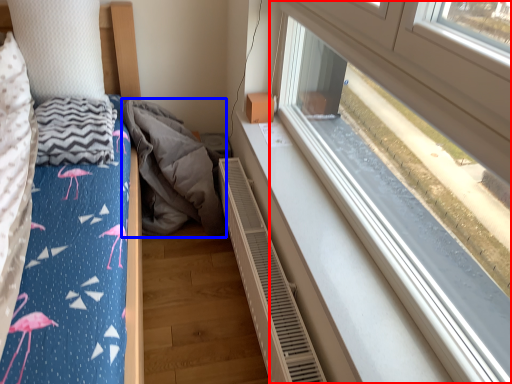
Question: Which object is closer to the camera taking this photo, window (highlighted by a red box) or material (highlighted by a blue box)?

Choices:
 (A) window
 (B) material

Answer: (A)